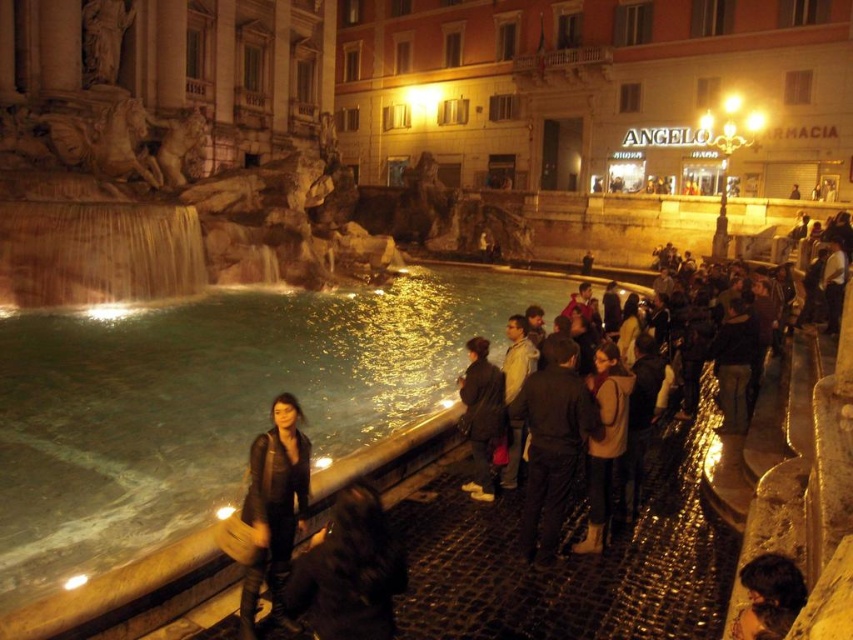
Question: Can you confirm if dark brown leather jacket at center right is bigger than leather jacket at center?

Choices:
 (A) yes
 (B) no

Answer: (A)

Question: Which of the following is the closest to the observer?

Choices:
 (A) dark fabric jacket at lower center
 (B) leather jacket at lower center

Answer: (A)

Question: Is dark fabric jacket at lower center bigger than dark brown leather jacket at center?

Choices:
 (A) no
 (B) yes

Answer: (A)

Question: Among these points, which one is farthest from the camera?

Choices:
 (A) (608, 461)
 (B) (535, 497)

Answer: (A)

Question: Based on their relative distances, which object is nearer to the brown suede boots at center?

Choices:
 (A) dark fabric jacket at lower center
 (B) leather jacket at center

Answer: (B)

Question: Does clear water at fountain left have a greater width compared to dark fabric jacket at lower center?

Choices:
 (A) yes
 (B) no

Answer: (A)